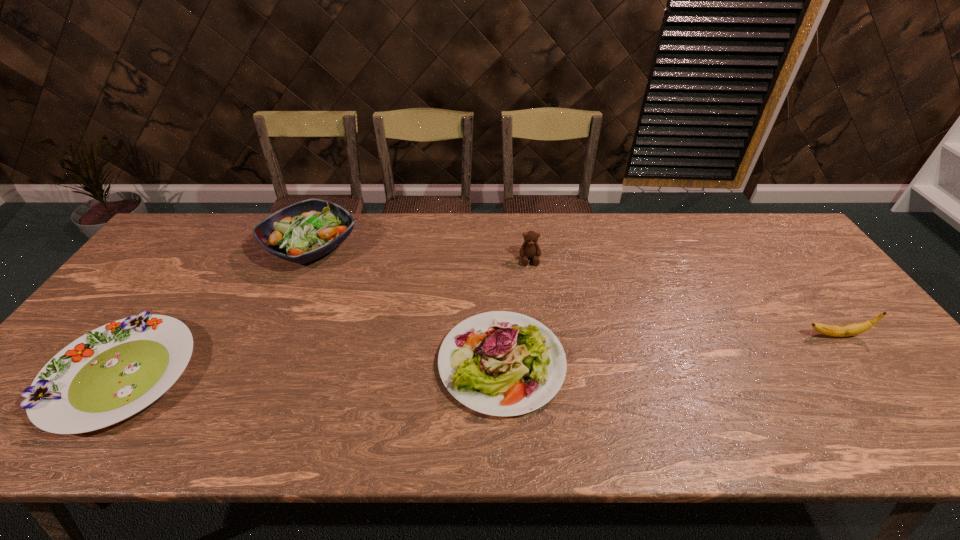
The width and height of the screenshot is (960, 540). In order to click on the tallest salad plate in this screenshot , I will do `click(304, 231)`.

Locate an element on the screen. Image resolution: width=960 pixels, height=540 pixels. teddy bear is located at coordinates (530, 249).

Image resolution: width=960 pixels, height=540 pixels. Identify the location of the rightmost object. (852, 329).

I want to click on the second shortest object, so click(x=500, y=363).

Locate an element on the screen. the rightmost salad plate is located at coordinates (500, 363).

Identify the location of vacant space located 0.270m on the right of the tallest salad plate. (444, 246).

I want to click on vacant space located on the face of the teddy bear, so click(x=537, y=314).

This screenshot has width=960, height=540. I want to click on blank area located on the peel of the rightmost object from the top, so click(x=746, y=335).

Identify the location of free space located on the peel of the rightmost object from the top. (742, 335).

Identify the location of free point located 0.050m on the peel of the rightmost object from the top. (785, 335).